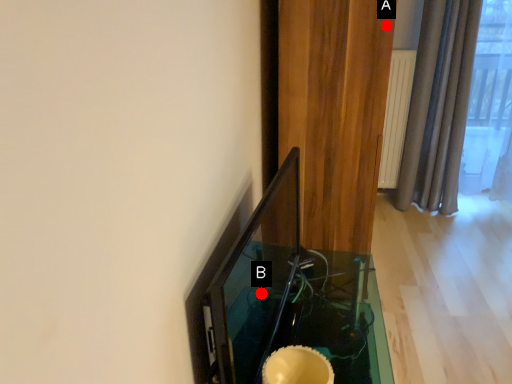
Question: Two points are circled on the image, labeled by A and B beside each circle. Which point is closer to the camera taking this photo?

Choices:
 (A) A is closer
 (B) B is closer

Answer: (B)